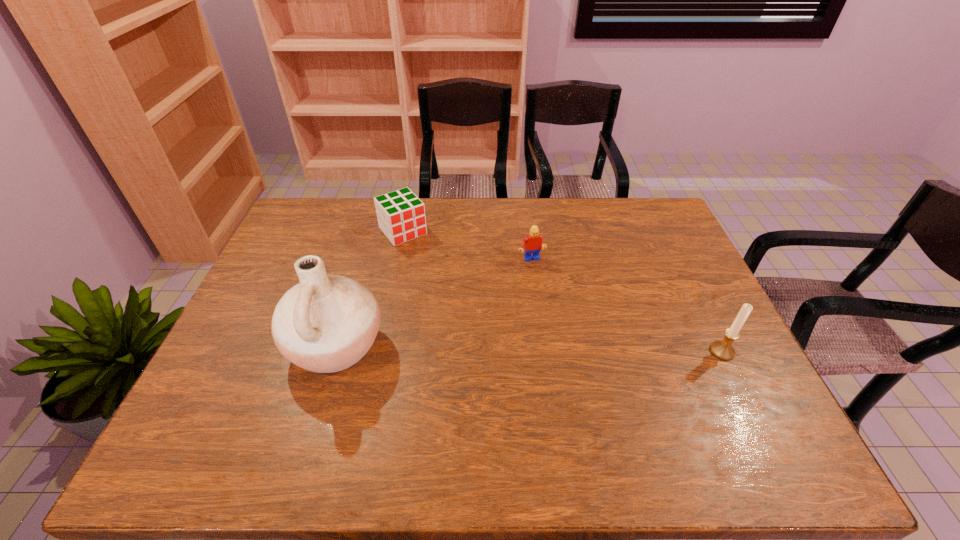
Where is `the tallest object`? the tallest object is located at coordinates (326, 323).

In order to click on candle holder in this screenshot , I will do `click(723, 350)`.

I want to click on the third shortest object, so click(x=723, y=350).

Find the location of a particular element. Lego is located at coordinates (532, 243).

Where is `the third object from left to right`? Image resolution: width=960 pixels, height=540 pixels. the third object from left to right is located at coordinates (532, 243).

Identify the location of the farthest object. This screenshot has height=540, width=960. (401, 216).

I want to click on free space located 0.080m to pour from the handle of the pottery, so click(x=256, y=346).

Identify the location of free space located to pour from the handle of the pottery. (260, 346).

Image resolution: width=960 pixels, height=540 pixels. Identify the location of blank area located on the left of the rightmost object. (680, 352).

At what (x,y) coordinates should I click in order to perform the action: click on free space located on the front-facing side of the third object from left to right. Please return your answer as a coordinate pair (x, y). The height and width of the screenshot is (540, 960). Looking at the image, I should click on (540, 276).